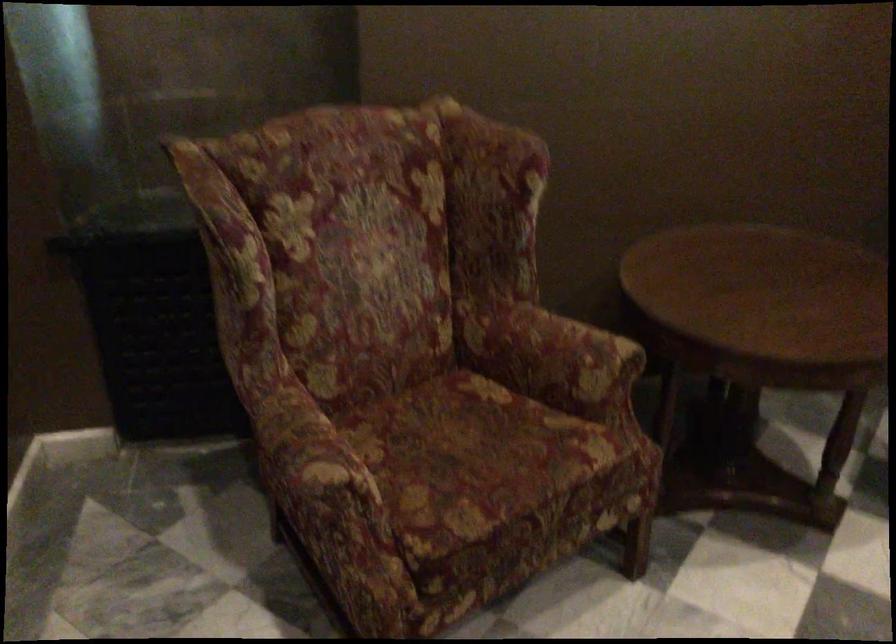
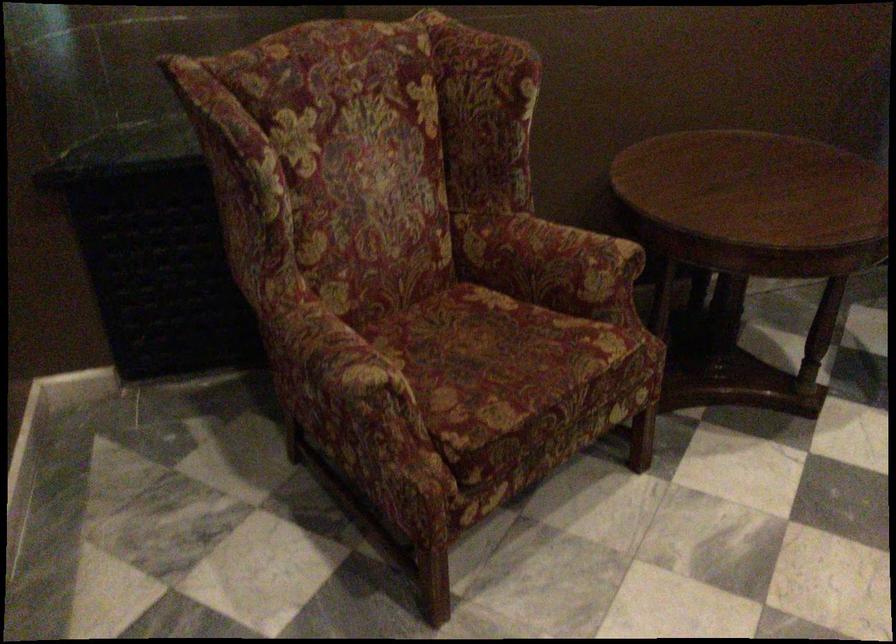
Where in the second image is the point corresponding to (x=475, y=462) from the first image?

(495, 363)